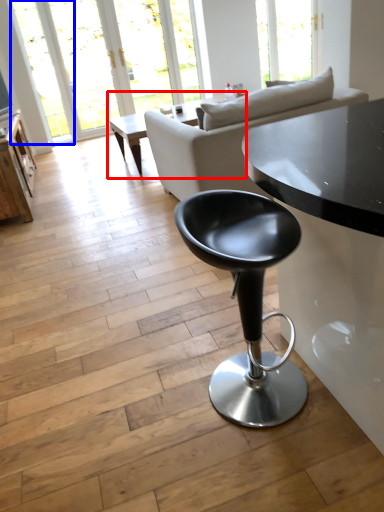
Question: Among these objects, which one is farthest to the camera, coffee table (highlighted by a red box) or window (highlighted by a blue box)?

Choices:
 (A) coffee table
 (B) window

Answer: (B)